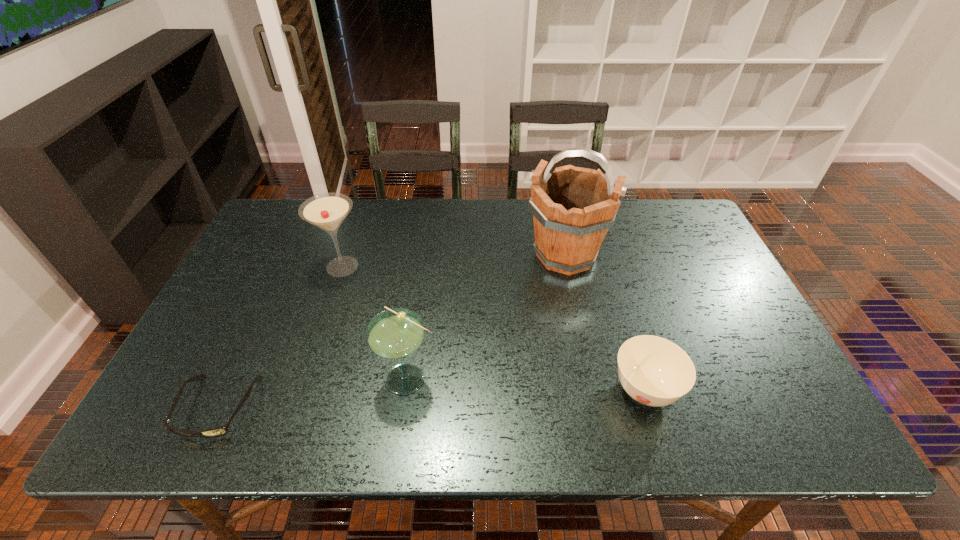
I want to click on vacant space situated 0.140m on the back of the right martini, so (418, 312).

This screenshot has width=960, height=540. What are the coordinates of `vacant region located 0.130m on the right of the fourth tallest object` in the screenshot? It's located at (737, 390).

Identify the location of object positioned at the far edge. (573, 207).

Image resolution: width=960 pixels, height=540 pixels. I want to click on sugar bowl that is at the near edge, so click(654, 371).

The width and height of the screenshot is (960, 540). Find the location of `spectacles at the near edge`. spectacles at the near edge is located at coordinates (219, 431).

Find the location of a particular element. The height and width of the screenshot is (540, 960). object located at the left edge is located at coordinates (219, 431).

Identify the location of object that is at the near left corner. (219, 431).

What are the coordinates of `vacant space at the far edge of the desktop` in the screenshot? It's located at (510, 228).

In the image, there is a desktop. At what (x,y) coordinates should I click in order to perform the action: click on vacant space at the near edge. Please return your answer as a coordinate pair (x, y). Looking at the image, I should click on (405, 411).

Find the location of a particular element. The image size is (960, 540). free space at the right edge of the desktop is located at coordinates (732, 328).